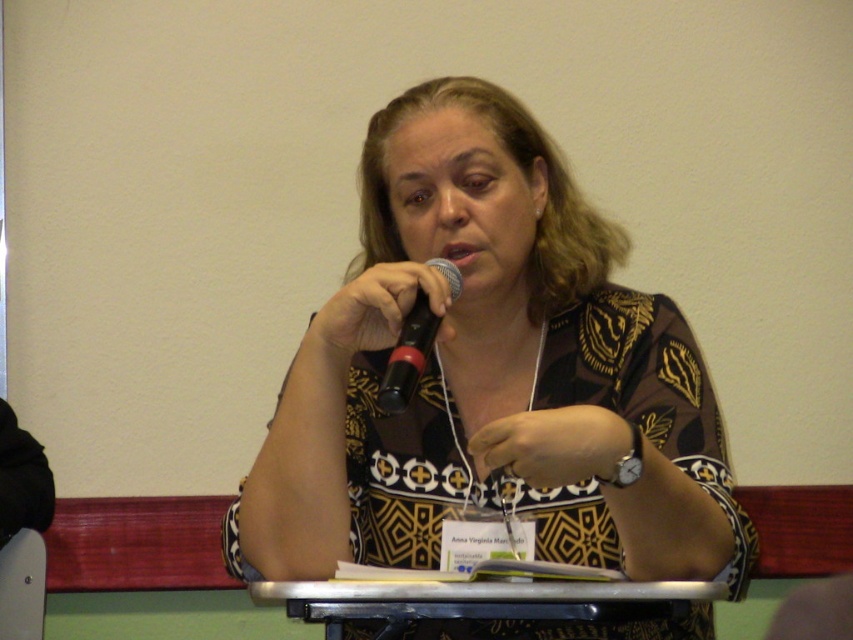
Does brown printed blouse at center appear on the right side of metallic silver table at center?

In fact, brown printed blouse at center is to the left of metallic silver table at center.

Find the location of a particular element. This screenshot has height=640, width=853. brown printed blouse at center is located at coordinates (490, 374).

Is the position of metallic silver table at center more distant than that of black matte microphone at center?

Yes.

Does metallic silver table at center appear on the left side of black matte microphone at center?

Incorrect, metallic silver table at center is not on the left side of black matte microphone at center.

Between point (599, 609) and point (403, 337), which one is positioned behind?

The point (403, 337) is behind.

You are a GUI agent. You are given a task and a screenshot of the screen. Output one action in this format:
    pyautogui.click(x=<x>, y=<y>)
    Task: Click on the metallic silver table at center
    
    Given the screenshot: What is the action you would take?
    pyautogui.click(x=482, y=600)

Who is positioned more to the left, brown printed blouse at center or black matte microphone at center?

black matte microphone at center is more to the left.

Is brown printed blouse at center wider than black matte microphone at center?

Yes.

Which is in front, point (490, 436) or point (399, 408)?

Positioned in front is point (399, 408).

Where is `brown printed blouse at center`? This screenshot has height=640, width=853. brown printed blouse at center is located at coordinates (490, 374).